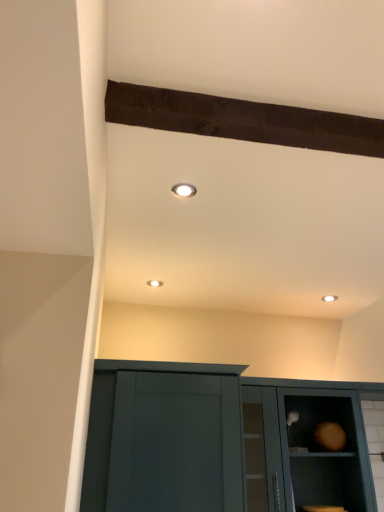
Question: Does matte dark green cabinet door at lower center have a lesser width compared to matte teal cabinet at lower right?

Choices:
 (A) no
 (B) yes

Answer: (A)

Question: Is matte dark green cabinet door at lower center shorter than matte teal cabinet at lower right?

Choices:
 (A) yes
 (B) no

Answer: (B)

Question: Can you confirm if matte dark green cabinet door at lower center is bigger than matte teal cabinet at lower right?

Choices:
 (A) yes
 (B) no

Answer: (A)

Question: From the image's perspective, is matte dark green cabinet door at lower center above matte teal cabinet at lower right?

Choices:
 (A) no
 (B) yes

Answer: (B)

Question: Is matte dark green cabinet door at lower center further to camera compared to matte teal cabinet at lower right?

Choices:
 (A) no
 (B) yes

Answer: (A)

Question: From the image's perspective, is matte white recessed light at upper center positioned above or below matte dark green cabinet door at lower center?

Choices:
 (A) below
 (B) above

Answer: (B)

Question: Based on their sizes in the image, would you say matte white recessed light at upper center is bigger or smaller than matte dark green cabinet door at lower center?

Choices:
 (A) big
 (B) small

Answer: (B)

Question: Visually, is matte white recessed light at upper center positioned to the left or to the right of matte dark green cabinet door at lower center?

Choices:
 (A) right
 (B) left

Answer: (A)

Question: In the image, is matte white recessed light at upper center positioned in front of or behind matte dark green cabinet door at lower center?

Choices:
 (A) behind
 (B) front

Answer: (B)

Question: From a real-world perspective, is matte white recessed light at upper center positioned above or below matte teal cabinet at lower right?

Choices:
 (A) above
 (B) below

Answer: (A)

Question: Would you say matte white recessed light at upper center is to the left or to the right of matte teal cabinet at lower right in the picture?

Choices:
 (A) right
 (B) left

Answer: (B)

Question: Is matte white recessed light at upper center bigger or smaller than matte teal cabinet at lower right?

Choices:
 (A) big
 (B) small

Answer: (B)

Question: Is matte white recessed light at upper center in front of or behind matte teal cabinet at lower right in the image?

Choices:
 (A) behind
 (B) front

Answer: (B)

Question: From a real-world perspective, is matte dark green cabinet door at lower center above or below matte white recessed light at upper center?

Choices:
 (A) above
 (B) below

Answer: (B)

Question: Is matte dark green cabinet door at lower center wider or thinner than matte white recessed light at upper center?

Choices:
 (A) thin
 (B) wide

Answer: (B)